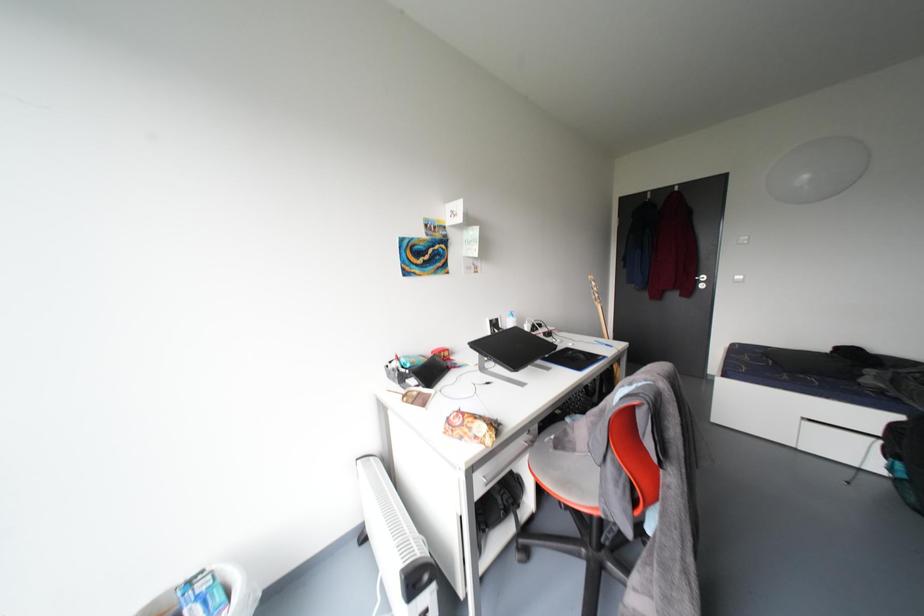
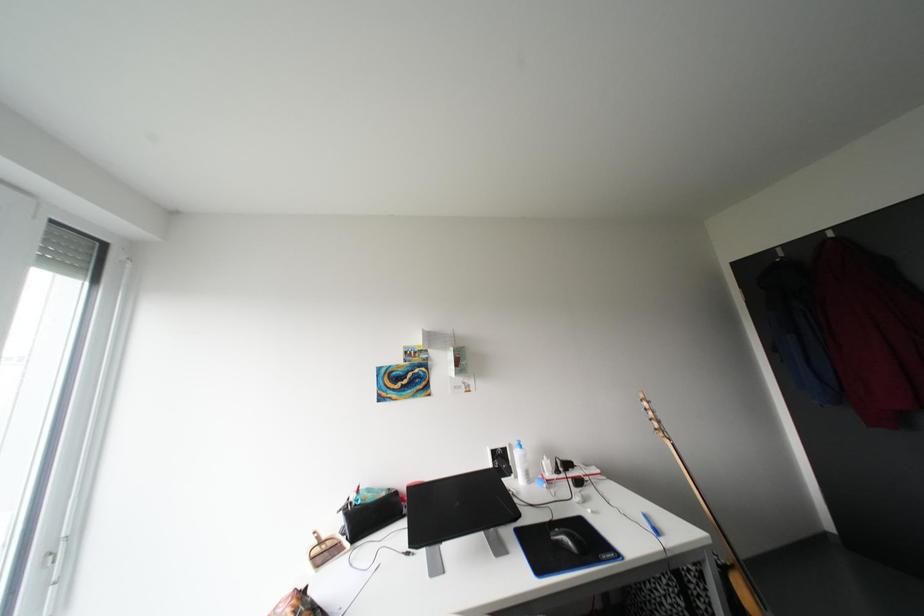
How did the camera likely rotate?

The camera's rotation is toward left-up.